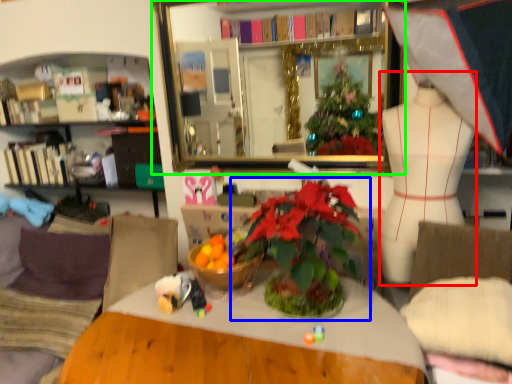
Question: Considering the real-world distances, which object is closest to mannequin (highlighted by a red box)? houseplant (highlighted by a blue box) or mirror (highlighted by a green box).

Choices:
 (A) houseplant
 (B) mirror

Answer: (A)